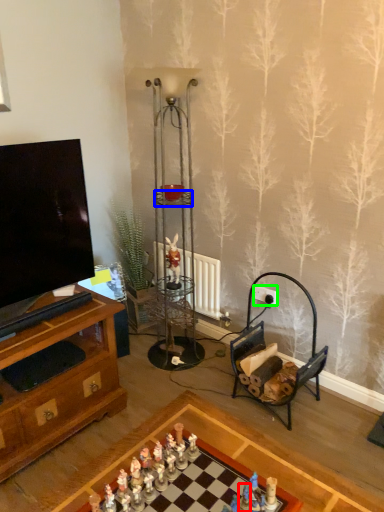
Question: Which is farther away from toy (highlighted by a red box)? shelf (highlighted by a blue box) or power outlet (highlighted by a green box)?

Choices:
 (A) shelf
 (B) power outlet

Answer: (A)